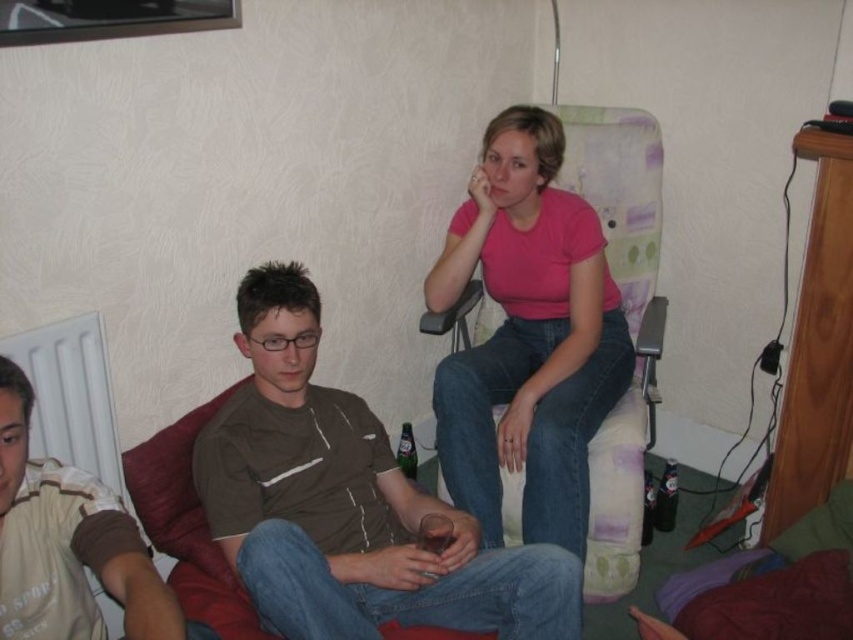
Between brown cotton shirt at center and green glass bottle at center, which one has less height?

green glass bottle at center

Does brown cotton shirt at center have a smaller size compared to green glass bottle at center?

No, brown cotton shirt at center is not smaller than green glass bottle at center.

Is point (341, 392) more distant than point (415, 480)?

No, (341, 392) is in front of (415, 480).

The height and width of the screenshot is (640, 853). Find the location of `brown cotton shirt at center`. brown cotton shirt at center is located at coordinates (347, 502).

Which is behind, point (564, 592) or point (674, 500)?

The point (674, 500) is behind.

Does brown cotton shirt at center appear under translucent plastic bottle at lower right?

No, brown cotton shirt at center is not below translucent plastic bottle at lower right.

Measure the distance between point (223, 422) and camera.

Point (223, 422) and camera are 1.72 meters apart from each other.

Where is `brown cotton shirt at center`? brown cotton shirt at center is located at coordinates (347, 502).

The width and height of the screenshot is (853, 640). What are the coordinates of `brown cotton shirt at lower left` in the screenshot? It's located at (68, 545).

Is brown cotton shirt at lower left smaller than green glass bottle at center?

Incorrect, brown cotton shirt at lower left is not smaller in size than green glass bottle at center.

You are a GUI agent. You are given a task and a screenshot of the screen. Output one action in this format:
    pyautogui.click(x=<x>, y=<y>)
    Task: Click on the brown cotton shirt at lower left
    The width and height of the screenshot is (853, 640).
    Given the screenshot: What is the action you would take?
    pyautogui.click(x=68, y=545)